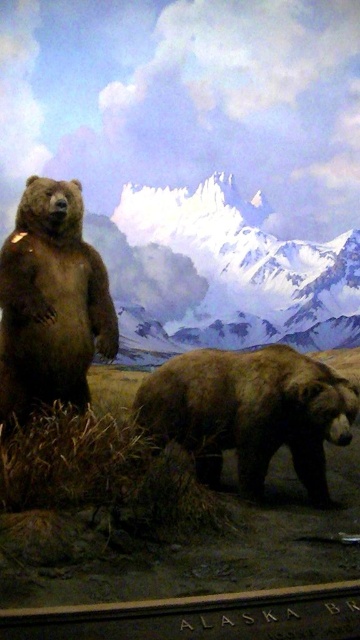
Which is more to the right, sandy brown fur at left or brown fuzzy bear at center?

Positioned to the right is sandy brown fur at left.

The height and width of the screenshot is (640, 360). I want to click on sandy brown fur at left, so click(221, 275).

Which of these two, sandy brown fur at left or shiny brown bear at left, stands taller?

With more height is sandy brown fur at left.

Does sandy brown fur at left appear over shiny brown bear at left?

Yes, sandy brown fur at left is above shiny brown bear at left.

Find the location of a particular element. This screenshot has height=640, width=360. sandy brown fur at left is located at coordinates coord(221,275).

You are a GUI agent. You are given a task and a screenshot of the screen. Output one action in this format:
    pyautogui.click(x=<x>, y=<y>)
    Task: Click on the sandy brown fur at left
    The image size is (360, 640).
    Given the screenshot: What is the action you would take?
    pyautogui.click(x=221, y=275)

Is brown fuzzy bear at center further to the viewer compared to shiny brown bear at left?

No, it is not.

Describe the element at coordinates (249, 412) in the screenshot. I see `brown fuzzy bear at center` at that location.

Who is more forward, (141, 387) or (23, 275)?

Positioned in front is point (23, 275).

You are a GUI agent. You are given a task and a screenshot of the screen. Output one action in this format:
    pyautogui.click(x=<x>, y=<y>)
    Task: Click on the brown fuzzy bear at center
    
    Given the screenshot: What is the action you would take?
    pyautogui.click(x=249, y=412)